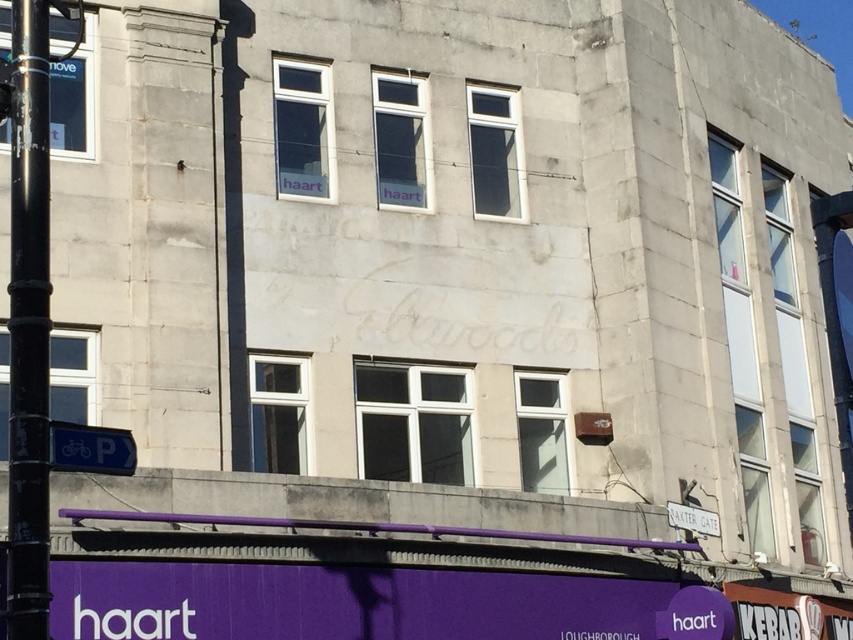
Consider the image. You are a driver looking for parking. You see a blue plastic parking sign at lower left and a white plastic sign at lower right. Which sign is taller?

The white plastic sign at lower right is taller than the blue plastic parking sign at lower left.

You are a driver looking for parking. You see a blue plastic parking sign at lower left and a white plastic sign at lower right. Which sign is closer to the left side of the road?

The blue plastic parking sign at lower left is closer to the left side of the road since it is positioned to the left of the white plastic sign at lower right.

You are a delivery person trying to park your bike near the blue plastic parking sign at lower left. There is a black metallic pole at left blocking the path. Based on the scene description, can you safely park your bike there without hitting the pole?

The black metallic pole at left is above the blue plastic parking sign at lower left, meaning it is positioned higher up and not directly in the path. Therefore, you can safely park your bike near the blue plastic parking sign at lower left without hitting the pole.